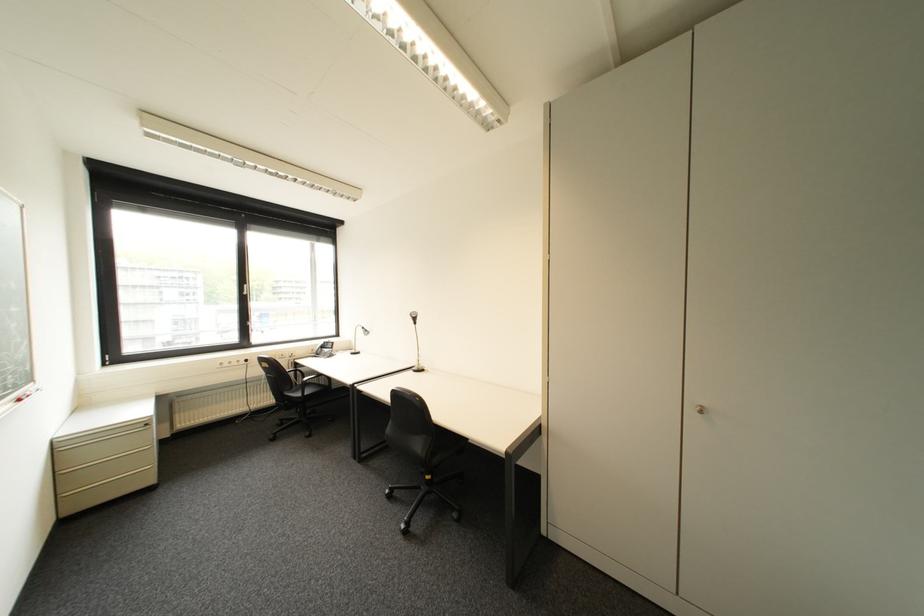
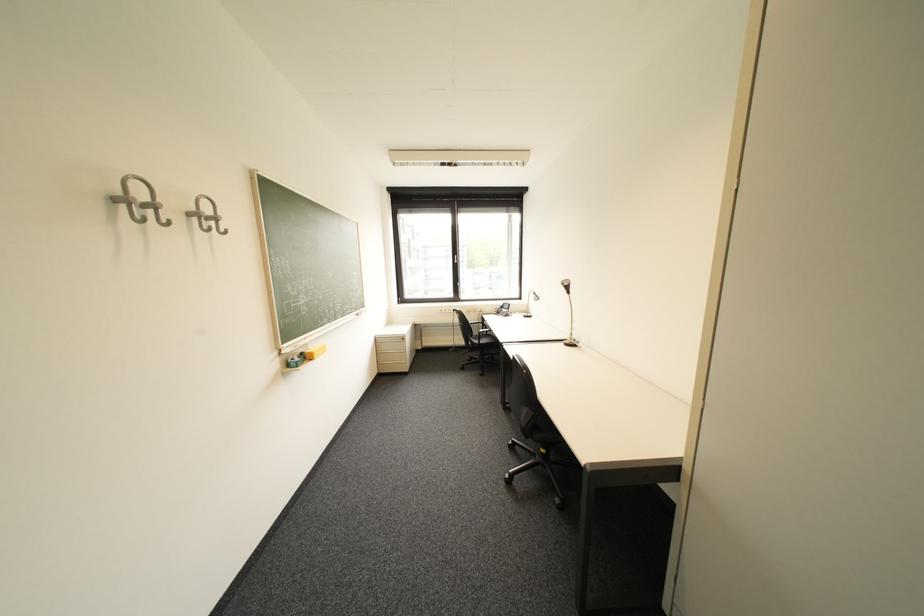
Locate, in the second image, the point that corresponds to [344,334] in the first image.

(528, 297)